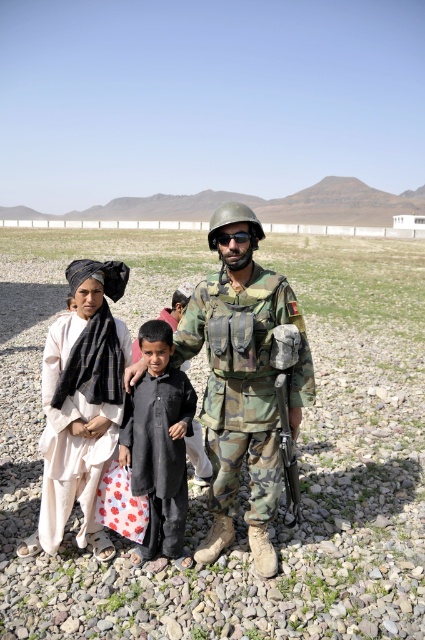
Question: Does camouflage fabric uniform at center have a greater width compared to black matte goggles at center?

Choices:
 (A) yes
 (B) no

Answer: (A)

Question: Which object is the farthest from the camouflage fabric uniform at center?

Choices:
 (A) white cotton dress at left
 (B) camouflage uniform at center
 (C) black matte clothing at center

Answer: (A)

Question: Estimate the real-world distances between objects in this image. Which object is farther from the black matte goggles at center?

Choices:
 (A) white cotton dress at left
 (B) black matte clothing at center
 (C) camouflage uniform at center
 (D) camouflage fabric uniform at center

Answer: (A)

Question: Is camouflage uniform at center smaller than black matte goggles at center?

Choices:
 (A) no
 (B) yes

Answer: (A)

Question: Can you confirm if camouflage uniform at center is bigger than camouflage fabric uniform at center?

Choices:
 (A) yes
 (B) no

Answer: (A)

Question: Among these objects, which one is farthest from the camera?

Choices:
 (A) white cotton dress at left
 (B) camouflage uniform at center
 (C) black matte clothing at center

Answer: (A)